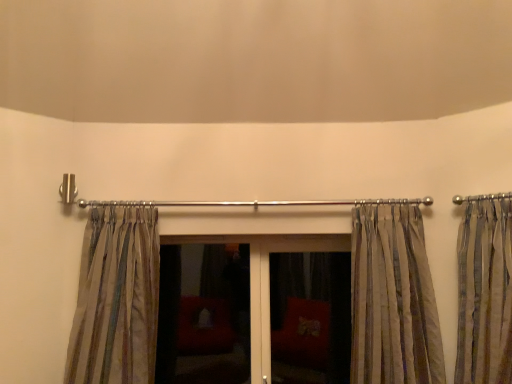
This screenshot has width=512, height=384. Describe the element at coordinates (484, 290) in the screenshot. I see `silky beige curtains at right, the 3th curtain viewed from the left` at that location.

What is the approximate width of matte glass door at center?

It is 8.05 inches.

Locate an element on the screen. This screenshot has height=384, width=512. striped fabric curtain at center, which is the 2th curtain in left-to-right order is located at coordinates (393, 299).

Measure the distance between silky beige curtain at left, acting as the 3th curtain starting from the right, and camera.

The distance of silky beige curtain at left, acting as the 3th curtain starting from the right, from camera is 2.06 meters.

Describe the element at coordinates (310, 317) in the screenshot. I see `matte glass screen door at center, which ranks as the 2th screen door in left-to-right order` at that location.

I want to click on matte glass screen door at center, arranged as the first screen door when viewed from the left, so click(203, 316).

Locate an element on the screen. The width and height of the screenshot is (512, 384). silky beige curtains at right, which is the first curtain from right to left is located at coordinates (484, 290).

In the scene shown: Can you confirm if silky beige curtains at right, which is the first curtain from right to left, is positioned to the right of matte glass screen door at center, marked as the second screen door in a right-to-left arrangement?

Correct, you'll find silky beige curtains at right, which is the first curtain from right to left, to the right of matte glass screen door at center, marked as the second screen door in a right-to-left arrangement.

Which of these two, silky beige curtains at right, which is the first curtain from right to left, or matte glass screen door at center, marked as the second screen door in a right-to-left arrangement, stands taller?

silky beige curtains at right, which is the first curtain from right to left, is taller.

Where is `the 1st screen door located beneath the silky beige curtains at right, the 3th curtain viewed from the left (from a real-world perspective)`? Image resolution: width=512 pixels, height=384 pixels. the 1st screen door located beneath the silky beige curtains at right, the 3th curtain viewed from the left (from a real-world perspective) is located at coordinates (203, 316).

How far apart are matte glass screen door at center, arranged as the first screen door when viewed from the left, and silky beige curtains at right, which is the first curtain from right to left?

matte glass screen door at center, arranged as the first screen door when viewed from the left, and silky beige curtains at right, which is the first curtain from right to left, are 2.49 meters apart from each other.

From the picture: From a real-world perspective, who is located higher, matte glass screen door at center, marked as the second screen door in a right-to-left arrangement, or silky beige curtains at right, which is the first curtain from right to left?

In real-world perspective, silky beige curtains at right, which is the first curtain from right to left, is above.

Can you tell me how much matte glass screen door at center, arranged as the first screen door when viewed from the left, and silky beige curtains at right, which is the first curtain from right to left, differ in facing direction?

The angular difference between matte glass screen door at center, arranged as the first screen door when viewed from the left, and silky beige curtains at right, which is the first curtain from right to left, is 45.4 degrees.

Does matte glass screen door at center, arranged as the first screen door when viewed from the left, appear on the left side of silky beige curtains at right, which is the first curtain from right to left?

Indeed, matte glass screen door at center, arranged as the first screen door when viewed from the left, is positioned on the left side of silky beige curtains at right, which is the first curtain from right to left.

How many degrees apart are the facing directions of striped fabric curtain at center, which is the 2th curtain in left-to-right order, and matte glass screen door at center, the 1th screen door in the right-to-left sequence?

striped fabric curtain at center, which is the 2th curtain in left-to-right order, and matte glass screen door at center, the 1th screen door in the right-to-left sequence, are facing 9.01 degrees away from each other.

Which of these two, striped fabric curtain at center, which is the 2th curtain in right-to-left order, or matte glass screen door at center, the 1th screen door in the right-to-left sequence, is thinner?

matte glass screen door at center, the 1th screen door in the right-to-left sequence, is thinner.

Is the depth of striped fabric curtain at center, which is the 2th curtain in right-to-left order, less than that of matte glass screen door at center, which ranks as the 2th screen door in left-to-right order?

Yes, striped fabric curtain at center, which is the 2th curtain in right-to-left order, is closer to the camera.

Would you consider striped fabric curtain at center, which is the 2th curtain in left-to-right order, to be distant from matte glass screen door at center, the 1th screen door in the right-to-left sequence?

No, striped fabric curtain at center, which is the 2th curtain in left-to-right order, is not far from matte glass screen door at center, the 1th screen door in the right-to-left sequence.

From a real-world perspective, is striped fabric curtain at center, which is the 2th curtain in right-to-left order, positioned above or below silky beige curtain at left, acting as the 3th curtain starting from the right?

In terms of real-world spatial position, striped fabric curtain at center, which is the 2th curtain in right-to-left order, is below silky beige curtain at left, acting as the 3th curtain starting from the right.

Is striped fabric curtain at center, which is the 2th curtain in right-to-left order, far from silky beige curtain at left, which is counted as the first curtain, starting from the left?

That's right, there is a large distance between striped fabric curtain at center, which is the 2th curtain in right-to-left order, and silky beige curtain at left, which is counted as the first curtain, starting from the left.

Considering the positions of points (410, 206) and (106, 309), is point (410, 206) closer to camera compared to point (106, 309)?

That is False.

Is striped fabric curtain at center, which is the 2th curtain in left-to-right order, oriented towards silky beige curtain at left, acting as the 3th curtain starting from the right?

No, striped fabric curtain at center, which is the 2th curtain in left-to-right order, is not turned towards silky beige curtain at left, acting as the 3th curtain starting from the right.

From a real-world perspective, is matte glass screen door at center, arranged as the first screen door when viewed from the left, positioned under striped fabric curtain at center, which is the 2th curtain in right-to-left order, based on gravity?

Indeed, from a real-world perspective, matte glass screen door at center, arranged as the first screen door when viewed from the left, is positioned beneath striped fabric curtain at center, which is the 2th curtain in right-to-left order.

From their relative heights in the image, would you say matte glass screen door at center, marked as the second screen door in a right-to-left arrangement, is taller or shorter than striped fabric curtain at center, which is the 2th curtain in left-to-right order?

Clearly, matte glass screen door at center, marked as the second screen door in a right-to-left arrangement, is shorter compared to striped fabric curtain at center, which is the 2th curtain in left-to-right order.

Is matte glass screen door at center, arranged as the first screen door when viewed from the left, outside of striped fabric curtain at center, which is the 2th curtain in right-to-left order?

That's correct, matte glass screen door at center, arranged as the first screen door when viewed from the left, is outside of striped fabric curtain at center, which is the 2th curtain in right-to-left order.

How different are the orientations of matte glass screen door at center, marked as the second screen door in a right-to-left arrangement, and striped fabric curtain at center, which is the 2th curtain in right-to-left order, in degrees?

The facing directions of matte glass screen door at center, marked as the second screen door in a right-to-left arrangement, and striped fabric curtain at center, which is the 2th curtain in right-to-left order, are 9.19 degrees apart.

Which of these two, striped fabric curtain at center, which is the 2th curtain in left-to-right order, or matte glass screen door at center, arranged as the first screen door when viewed from the left, stands shorter?

Standing shorter between the two is matte glass screen door at center, arranged as the first screen door when viewed from the left.

Is striped fabric curtain at center, which is the 2th curtain in right-to-left order, inside the boundaries of matte glass screen door at center, marked as the second screen door in a right-to-left arrangement, or outside?

striped fabric curtain at center, which is the 2th curtain in right-to-left order, is not enclosed by matte glass screen door at center, marked as the second screen door in a right-to-left arrangement.

Which of these two, striped fabric curtain at center, which is the 2th curtain in right-to-left order, or matte glass screen door at center, marked as the second screen door in a right-to-left arrangement, is smaller?

With smaller size is matte glass screen door at center, marked as the second screen door in a right-to-left arrangement.

Based on the photo, is matte glass door at center bigger or smaller than matte glass screen door at center, the 1th screen door in the right-to-left sequence?

In the image, matte glass door at center appears to be larger than matte glass screen door at center, the 1th screen door in the right-to-left sequence.

Is matte glass door at center placed right next to matte glass screen door at center, the 1th screen door in the right-to-left sequence?

No, matte glass door at center is not next to matte glass screen door at center, the 1th screen door in the right-to-left sequence.

Is matte glass door at center spatially inside matte glass screen door at center, the 1th screen door in the right-to-left sequence, or outside of it?

matte glass door at center lies within the bounds of matte glass screen door at center, the 1th screen door in the right-to-left sequence.

From the silky beige curtains at right, which is the first curtain from right to left, count the 2nd screen door to the left and point to it. Please provide its 2D coordinates.

[(203, 316)]

In order to click on the 2nd screen door behind when counting from the silky beige curtains at right, which is the first curtain from right to left in this screenshot , I will do `click(203, 316)`.

When comparing their distances from striped fabric curtain at center, which is the 2th curtain in left-to-right order, does silky beige curtains at right, the 3th curtain viewed from the left, or matte glass screen door at center, marked as the second screen door in a right-to-left arrangement, seem further?

matte glass screen door at center, marked as the second screen door in a right-to-left arrangement, is positioned further to the anchor striped fabric curtain at center, which is the 2th curtain in left-to-right order.

Estimate the real-world distances between objects in this image. Which object is further from striped fabric curtain at center, which is the 2th curtain in right-to-left order, silky beige curtains at right, the 3th curtain viewed from the left, or matte glass screen door at center, the 1th screen door in the right-to-left sequence?

matte glass screen door at center, the 1th screen door in the right-to-left sequence, is positioned further to the anchor striped fabric curtain at center, which is the 2th curtain in right-to-left order.

Looking at the image, which one is located further to striped fabric curtain at center, which is the 2th curtain in left-to-right order, silky beige curtain at left, acting as the 3th curtain starting from the right, or matte glass door at center?

silky beige curtain at left, acting as the 3th curtain starting from the right, is positioned further to the anchor striped fabric curtain at center, which is the 2th curtain in left-to-right order.

Estimate the real-world distances between objects in this image. Which object is further from silky beige curtain at left, which is counted as the first curtain, starting from the left, matte glass door at center or striped fabric curtain at center, which is the 2th curtain in left-to-right order?

Based on the image, striped fabric curtain at center, which is the 2th curtain in left-to-right order, appears to be further to silky beige curtain at left, which is counted as the first curtain, starting from the left.

Based on their spatial positions, is striped fabric curtain at center, which is the 2th curtain in right-to-left order, or matte glass screen door at center, the 1th screen door in the right-to-left sequence, further from matte glass screen door at center, marked as the second screen door in a right-to-left arrangement?

Based on the image, striped fabric curtain at center, which is the 2th curtain in right-to-left order, appears to be further to matte glass screen door at center, marked as the second screen door in a right-to-left arrangement.

From the image, which object appears to be farther from matte glass screen door at center, the 1th screen door in the right-to-left sequence, striped fabric curtain at center, which is the 2th curtain in left-to-right order, or matte glass door at center?

striped fabric curtain at center, which is the 2th curtain in left-to-right order, is further to matte glass screen door at center, the 1th screen door in the right-to-left sequence.

Considering their positions, is matte glass screen door at center, arranged as the first screen door when viewed from the left, positioned further to silky beige curtains at right, the 3th curtain viewed from the left, than silky beige curtain at left, which is counted as the first curtain, starting from the left?

Based on the image, matte glass screen door at center, arranged as the first screen door when viewed from the left, appears to be further to silky beige curtains at right, the 3th curtain viewed from the left.

Looking at the image, which one is located closer to silky beige curtain at left, which is counted as the first curtain, starting from the left, matte glass screen door at center, which ranks as the 2th screen door in left-to-right order, or matte glass door at center?

matte glass door at center is positioned closer to the anchor silky beige curtain at left, which is counted as the first curtain, starting from the left.

The width and height of the screenshot is (512, 384). Identify the location of screen door between matte glass screen door at center, arranged as the first screen door when viewed from the left, and silky beige curtains at right, which is the first curtain from right to left. (310, 317).

The height and width of the screenshot is (384, 512). I want to click on door between silky beige curtain at left, acting as the 3th curtain starting from the right, and matte glass screen door at center, the 1th screen door in the right-to-left sequence, so click(266, 279).

Locate an element on the screen. This screenshot has width=512, height=384. curtain located between silky beige curtain at left, which is counted as the first curtain, starting from the left, and silky beige curtains at right, which is the first curtain from right to left, in the left-right direction is located at coordinates (393, 299).

Identify the location of screen door between matte glass screen door at center, arranged as the first screen door when viewed from the left, and striped fabric curtain at center, which is the 2th curtain in right-to-left order, in the horizontal direction. (310, 317).